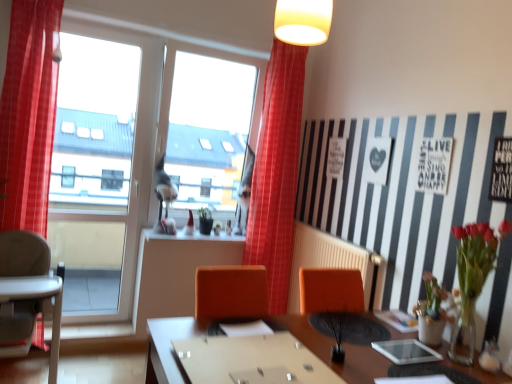
Describe the element at coordinates (277, 172) in the screenshot. This screenshot has height=384, width=512. I see `red checkered curtain at center, the 2th curtain when ordered from front to back` at that location.

Locate an element on the screen. The image size is (512, 384). gray plastic highchair at left is located at coordinates (27, 292).

What do you see at coordinates (332, 261) in the screenshot? This screenshot has height=384, width=512. I see `white plastic radiator at center` at bounding box center [332, 261].

At what (x,y) coordinates should I click in order to perform the action: click on green matte plant at center, the 1th plant viewed from the back. Please return your answer as a coordinate pair (x, y). Looking at the image, I should click on (205, 220).

Find the location of a particular element. Image resolution: width=512 pixels, height=384 pixels. green matte plant at center, the 2th plant from the back is located at coordinates (342, 330).

Image resolution: width=512 pixels, height=384 pixels. I want to click on transparent glass window at left, so coord(93,172).

Measure the distance between red plaid curtain at left, placed as the 1th curtain when sorted from left to right, and camera.

The depth of red plaid curtain at left, placed as the 1th curtain when sorted from left to right, is 8.29 feet.

At what (x,y) coordinates should I click in order to perform the action: click on red checkered curtain at center, the 2th curtain when ordered from front to back. Please return your answer as a coordinate pair (x, y). Image resolution: width=512 pixels, height=384 pixels. Looking at the image, I should click on (277, 172).

Would you say vivid red bouquet at right is inside or outside red plaid curtain at left, which is the 2th curtain from right to left?

The correct answer is: outside.

Could you tell me if vivid red bouquet at right is turned towards red plaid curtain at left, marked as the first curtain in a front-to-back arrangement?

No, vivid red bouquet at right is not turned towards red plaid curtain at left, marked as the first curtain in a front-to-back arrangement.

What's the angular difference between vivid red bouquet at right and red plaid curtain at left, the 2th curtain viewed from the back,'s facing directions?

vivid red bouquet at right and red plaid curtain at left, the 2th curtain viewed from the back, are facing 91 degrees away from each other.

From the image's perspective, count 1st curtains upward from the vivid red bouquet at right and point to it. Please provide its 2D coordinates.

[(29, 114)]

From a real-world perspective, which is physically above, red plaid curtain at left, placed as the 1th curtain when sorted from left to right, or wooden table at center?

red plaid curtain at left, placed as the 1th curtain when sorted from left to right, is physically above.

Between red plaid curtain at left, marked as the first curtain in a front-to-back arrangement, and wooden table at center, which one has larger width?

wooden table at center.

Is red plaid curtain at left, marked as the first curtain in a front-to-back arrangement, placed right next to wooden table at center?

No, red plaid curtain at left, marked as the first curtain in a front-to-back arrangement, is not next to wooden table at center.

Does gray plastic highchair at left appear on the left side of white plastic radiator at center?

Correct, you'll find gray plastic highchair at left to the left of white plastic radiator at center.

The height and width of the screenshot is (384, 512). In order to click on chair located in front of the white plastic radiator at center in this screenshot , I will do `click(27, 292)`.

Can you confirm if gray plastic highchair at left is taller than white plastic radiator at center?

Yes, gray plastic highchair at left is taller than white plastic radiator at center.

Between gray plastic highchair at left and white plastic radiator at center, which one is positioned in front?

Positioned in front is gray plastic highchair at left.

Is green matte plant at center, which ranks as the first plant in bottom-to-top order, next to red plaid curtain at left, marked as the first curtain in a front-to-back arrangement?

No, green matte plant at center, which ranks as the first plant in bottom-to-top order, is not next to red plaid curtain at left, marked as the first curtain in a front-to-back arrangement.

How different are the orientations of green matte plant at center, acting as the 2th plant starting from the top, and red plaid curtain at left, which is the 2th curtain from right to left, in degrees?

The angle between the facing direction of green matte plant at center, acting as the 2th plant starting from the top, and the facing direction of red plaid curtain at left, which is the 2th curtain from right to left, is 179 degrees.

Is point (362, 323) in front of point (47, 142)?

Yes.

Which of these two, wooden table at center or green matte plant at center, the first plant viewed from the left, stands shorter?

Standing shorter between the two is green matte plant at center, the first plant viewed from the left.

Which point is more forward, (x=160, y=341) or (x=203, y=210)?

The point (x=160, y=341) is closer.

Which object is further away from the camera, wooden table at center or green matte plant at center, the 1th plant viewed from the back?

green matte plant at center, the 1th plant viewed from the back, is further from the camera.

Is wooden table at center in contact with green matte plant at center, the first plant viewed from the left?

No.

This screenshot has width=512, height=384. I want to click on table lying on the left of vivid red bouquet at right, so click(344, 347).

Can we say vivid red bouquet at right lies outside wooden table at center?

Yes, vivid red bouquet at right is not within wooden table at center.

Considering the relative sizes of vivid red bouquet at right and wooden table at center in the image provided, is vivid red bouquet at right thinner than wooden table at center?

Yes, vivid red bouquet at right is thinner than wooden table at center.

Are vivid red bouquet at right and wooden table at center far apart?

Yes.

Does point (208, 358) come farther from viewer compared to point (332, 255)?

No, (208, 358) is closer to viewer.

Is wooden table at center oriented towards white plastic radiator at center?

No, wooden table at center is not oriented towards white plastic radiator at center.

From a real-world perspective, is wooden table at center located beneath white plastic radiator at center?

No, from a real-world perspective, wooden table at center is not under white plastic radiator at center.

Between wooden table at center and white plastic radiator at center, which one has less height?

wooden table at center is shorter.

At what (x,y) coordinates should I click in order to perform the action: click on the 1st curtain directly above the vivid red bouquet at right (from a real-world perspective). Please return your answer as a coordinate pair (x, y). Looking at the image, I should click on (29, 114).

Where is `table lying below the red plaid curtain at left, which is the 2th curtain from right to left (from the image's perspective)`? table lying below the red plaid curtain at left, which is the 2th curtain from right to left (from the image's perspective) is located at coordinates (344, 347).

Estimate the real-world distances between objects in this image. Which object is closer to transparent glass window at left, transparent glass window at center or red checkered curtain at center, which is the 1th curtain from right to left?

Based on the image, transparent glass window at center appears to be nearer to transparent glass window at left.

From the image, which object appears to be nearer to wooden table at center, red plaid curtain at left, the 2th curtain viewed from the back, or transparent glass window at center?

red plaid curtain at left, the 2th curtain viewed from the back, is positioned closer to the anchor wooden table at center.

Based on their spatial positions, is transparent glass window at left or vivid red bouquet at right closer to gray plastic highchair at left?

transparent glass window at left.

When comparing their distances from red plaid curtain at left, marked as the first curtain in a front-to-back arrangement, does green matte plant at center, the first plant viewed from the left, or transparent glass window at center seem closer?

Among the two, transparent glass window at center is located nearer to red plaid curtain at left, marked as the first curtain in a front-to-back arrangement.

Looking at the image, which one is located further to wooden table at center, transparent glass window at left or white plastic radiator at center?

transparent glass window at left is further to wooden table at center.

Considering their positions, is white plastic radiator at center positioned closer to green matte plant at center, which is the second plant from bottom to top, than red plaid curtain at left, which is the 2th curtain from right to left?

white plastic radiator at center is closer to green matte plant at center, which is the second plant from bottom to top.

Looking at the image, which one is located further to white plastic radiator at center, transparent glass window at center or vivid red bouquet at right?

transparent glass window at center lies further to white plastic radiator at center than the other object.

Which object lies further to the anchor point green matte plant at center, acting as the 2th plant starting from the top, transparent glass window at center or wooden table at center?

transparent glass window at center lies further to green matte plant at center, acting as the 2th plant starting from the top, than the other object.

Locate an element on the screen. The image size is (512, 384). chair between red plaid curtain at left, marked as the first curtain in a front-to-back arrangement, and wooden table at center is located at coordinates (27, 292).

This screenshot has height=384, width=512. Find the location of `round table between wooden table at center and green matte plant at center, which ranks as the first plant in right-to-left order, in the front-back direction`. round table between wooden table at center and green matte plant at center, which ranks as the first plant in right-to-left order, in the front-back direction is located at coordinates (251, 360).

The height and width of the screenshot is (384, 512). I want to click on window frame between red plaid curtain at left, the 2th curtain viewed from the back, and red checkered curtain at center, placed as the first curtain when sorted from back to front, so click(x=93, y=172).

Find the location of a particular element. This screenshot has height=384, width=512. window frame between wooden table at center and transparent glass window at center in the front-back direction is located at coordinates (93, 172).